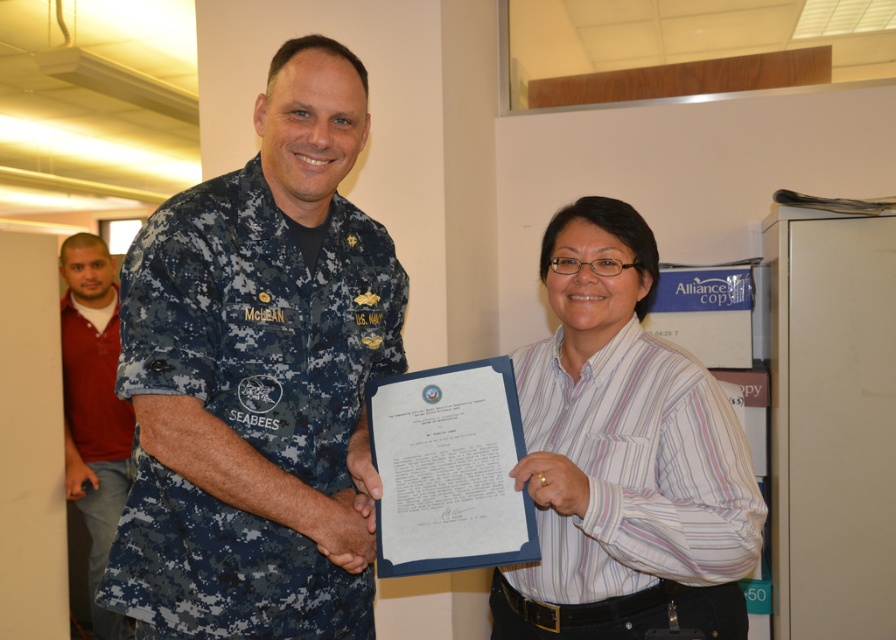
You are a photographer at a formal event. You need to position two guests for a group photo. The guests are wearing the white striped shirt at center and the red cotton shirt at left. Based on their current positions and heights, which guest should stand where to ensure both are visible in the photo?

The white striped shirt at center is not as tall as the red cotton shirt at left, so to ensure both are visible in the photo, the shorter white striped shirt at center should stand in the front and the taller red cotton shirt at left should stand behind.

You are a photographer at a formal event. You need to ensure that both the digital camouflage uniform at center and the white striped shirt at center are clearly visible in the photo. Considering their sizes, which one might require more careful framing to avoid being overshadowed?

The white striped shirt at center might require more careful framing to avoid being overshadowed since the digital camouflage uniform at center is bigger and could dominate the image.

You are organizing a military event and need to seat the digital camouflage uniform at center and the red cotton shirt at left. Which person requires a wider seat?

The digital camouflage uniform at center requires a wider seat since their width surpasses that of the red cotton shirt at left.